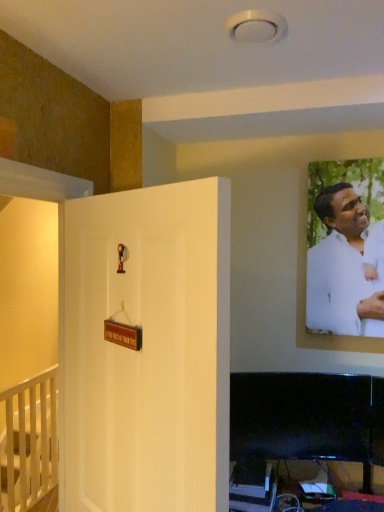
Question: Does white wooden railing at lower left, arranged as the first furniture when ordered from the bottom, have a smaller size compared to white matte door at center?

Choices:
 (A) no
 (B) yes

Answer: (A)

Question: Considering the relative sizes of white wooden railing at lower left, which is the 2th furniture from right to left, and white matte door at center in the image provided, is white wooden railing at lower left, which is the 2th furniture from right to left, thinner than white matte door at center?

Choices:
 (A) yes
 (B) no

Answer: (B)

Question: Is white wooden railing at lower left, which is the 2th furniture from right to left, facing away from white matte door at center?

Choices:
 (A) yes
 (B) no

Answer: (B)

Question: Does white wooden railing at lower left, which is the 2th furniture from right to left, have a greater height compared to white matte door at center?

Choices:
 (A) no
 (B) yes

Answer: (A)

Question: Could white matte door at center be considered to be inside white wooden railing at lower left, arranged as the first furniture when ordered from the bottom?

Choices:
 (A) no
 (B) yes

Answer: (A)

Question: Is white wooden railing at lower left, which is the 2th furniture from right to left, wider than white matte door at center?

Choices:
 (A) no
 (B) yes

Answer: (B)

Question: From the image's perspective, is black glossy tv at lower right, acting as the 1th furniture starting from the front, under white wooden railing at lower left, arranged as the first furniture when viewed from the back?

Choices:
 (A) no
 (B) yes

Answer: (A)

Question: Could you tell me if black glossy tv at lower right, the 1th furniture positioned from the right, is turned towards white wooden railing at lower left, which ranks as the first furniture in left-to-right order?

Choices:
 (A) no
 (B) yes

Answer: (A)

Question: From a real-world perspective, is black glossy tv at lower right, which is the second furniture from bottom to top, located beneath white wooden railing at lower left, arranged as the first furniture when ordered from the bottom?

Choices:
 (A) no
 (B) yes

Answer: (A)

Question: Does black glossy tv at lower right, marked as the 2th furniture in a left-to-right arrangement, have a greater height compared to white wooden railing at lower left, arranged as the first furniture when ordered from the bottom?

Choices:
 (A) yes
 (B) no

Answer: (B)

Question: Considering the relative sizes of black glossy tv at lower right, marked as the 2th furniture in a left-to-right arrangement, and white wooden railing at lower left, marked as the second furniture in a front-to-back arrangement, in the image provided, is black glossy tv at lower right, marked as the 2th furniture in a left-to-right arrangement, shorter than white wooden railing at lower left, marked as the second furniture in a front-to-back arrangement,?

Choices:
 (A) yes
 (B) no

Answer: (A)

Question: Is the depth of black glossy tv at lower right, which is the second furniture from bottom to top, greater than that of white wooden railing at lower left, which is counted as the 2th furniture, starting from the top?

Choices:
 (A) yes
 (B) no

Answer: (B)

Question: Considering the relative sizes of white matte door at center and white matte shirt at upper right in the image provided, is white matte door at center smaller than white matte shirt at upper right?

Choices:
 (A) no
 (B) yes

Answer: (A)